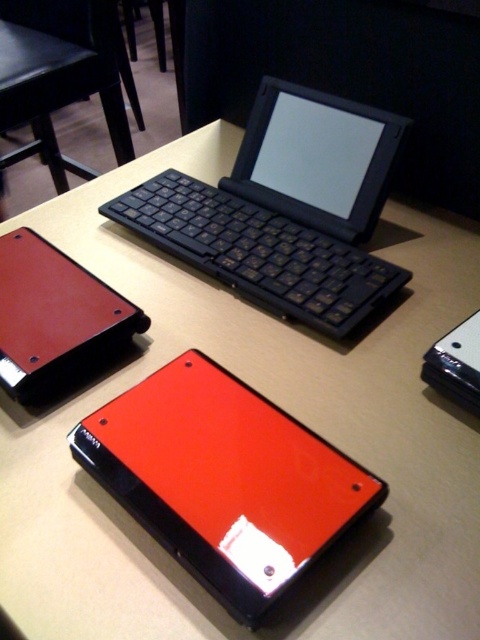
You are setting up a workstation and need to place the black matte keyboard at center and the matte black keyboard at upper center on a desk. What is the minimum distance you should leave between them to ensure they are properly spaced?

The minimum distance between the black matte keyboard at center and the matte black keyboard at upper center should be at least 39.01 inches to maintain proper spacing.

You are organizing items on a table. You have a glossy red tablet at center and a glossy leather tablet at lower left. Which one has a greater width?

The glossy red tablet at center might be wider than glossy leather tablet at lower left.

You are organizing items on a table and need to place a new item between the glossy red tablet at center and the glossy leather tablet at lower left. Based on their positions, where should you place the new item?

The glossy red tablet at center is to the right of the glossy leather tablet at lower left, so you should place the new item between them to the left of the glossy red tablet at center and to the right of the glossy leather tablet at lower left.